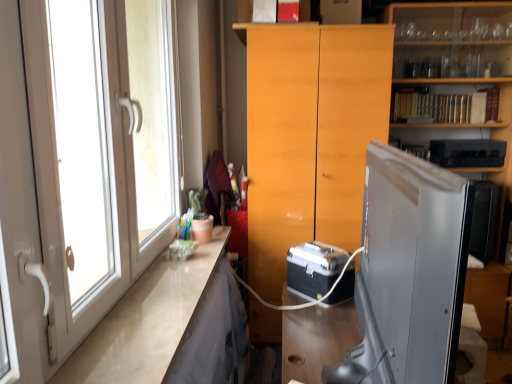
Find the location of a particular element. This screenshot has height=384, width=512. unoccupied space behind white glossy door at left is located at coordinates (163, 289).